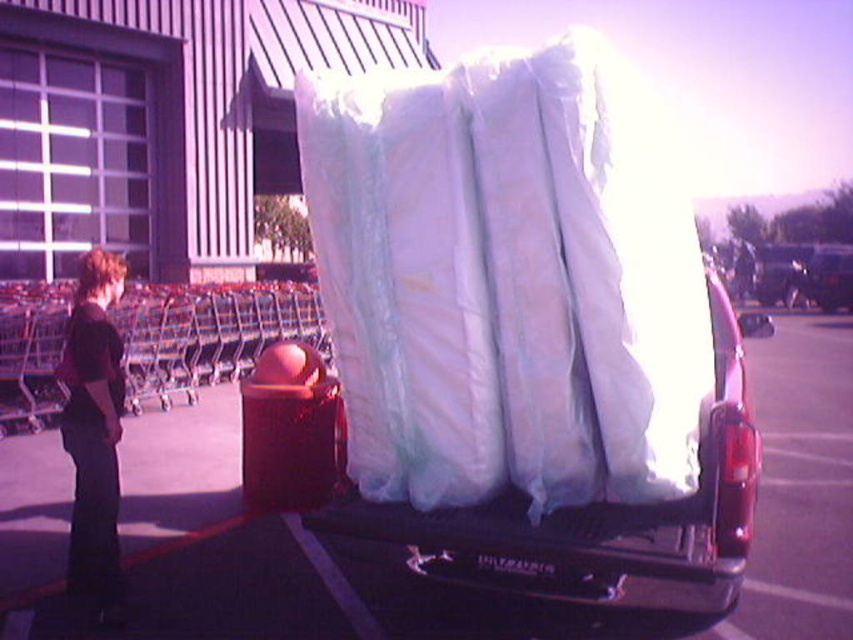
You are a delivery person trying to secure the translucent plastic mattress at center and the dark brown hair at left in the truck bed. Which item should you place first to ensure proper loading?

The translucent plastic mattress at center should be placed first because it is above the dark brown hair at left, indicating it needs to be positioned lower in the truck bed to support the other item.

You are a delivery person trying to secure the load on the truck bed. You have two points marked on the truck bed at coordinates point (643, 326) and point (90, 516). Which point is closer to the camera so you can attach the securing strap there first?

Point (643, 326) is closer to the camera than point (90, 516), so you should attach the securing strap there first.